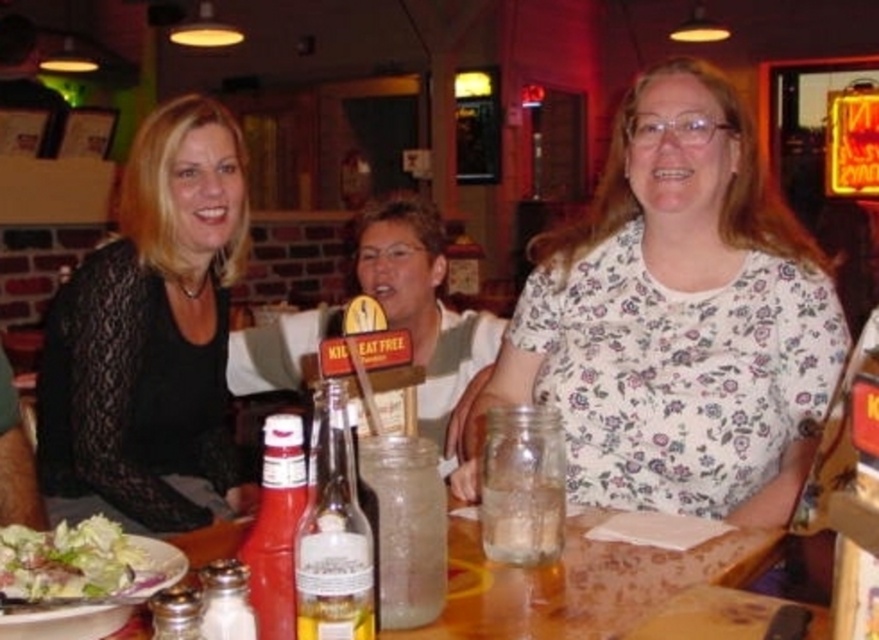
Which of these two, floral cotton shirt at center or black lace top at left, stands shorter?

With less height is floral cotton shirt at center.

Between floral cotton shirt at center and black lace top at left, which one appears on the right side from the viewer's perspective?

floral cotton shirt at center is more to the right.

Who is more distant from viewer, (672, 156) or (238, 486)?

Positioned behind is point (238, 486).

Locate an element on the screen. The image size is (879, 640). floral cotton shirt at center is located at coordinates (676, 320).

Can you confirm if floral cotton shirt at center is positioned above wooden table at center?

Yes, floral cotton shirt at center is above wooden table at center.

Between floral cotton shirt at center and wooden table at center, which one appears on the right side from the viewer's perspective?

floral cotton shirt at center

Which is in front, point (721, 308) or point (614, 620)?

Point (614, 620) is more forward.

Image resolution: width=879 pixels, height=640 pixels. What are the coordinates of `floral cotton shirt at center` in the screenshot? It's located at (676, 320).

Can you confirm if black lace top at left is bigger than green leafy salad at lower left?

Indeed, black lace top at left has a larger size compared to green leafy salad at lower left.

Is black lace top at left further to camera compared to green leafy salad at lower left?

Yes, black lace top at left is further from the viewer.

Does point (132, 305) lie in front of point (20, 564)?

That is False.

Locate an element on the screen. black lace top at left is located at coordinates tap(151, 333).